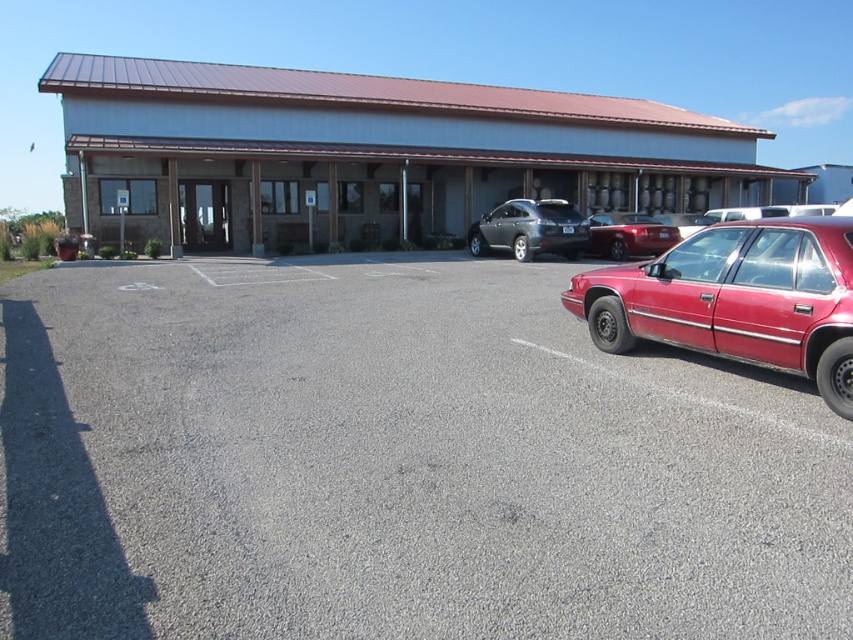
Does glossy red sedan at right have a larger size compared to satin black sedan at center?

Yes.

Does point (747, 268) lie behind point (526, 209)?

No, (747, 268) is closer to viewer.

Which is behind, point (749, 282) or point (474, 232)?

The point (474, 232) is more distant.

Identify the location of glossy red sedan at right. (737, 300).

Is point (236, 420) more distant than point (641, 221)?

That is False.

Is point (267, 392) less distant than point (647, 234)?

That is True.

In order to click on gray asphalt parking lot at lower right in this screenshot , I will do `click(396, 464)`.

Can you confirm if gray asphalt parking lot at lower right is thinner than satin black sedan at center?

Incorrect, gray asphalt parking lot at lower right's width is not less than satin black sedan at center's.

The image size is (853, 640). What do you see at coordinates (396, 464) in the screenshot?
I see `gray asphalt parking lot at lower right` at bounding box center [396, 464].

This screenshot has width=853, height=640. Find the location of `gray asphalt parking lot at lower right`. gray asphalt parking lot at lower right is located at coordinates (396, 464).